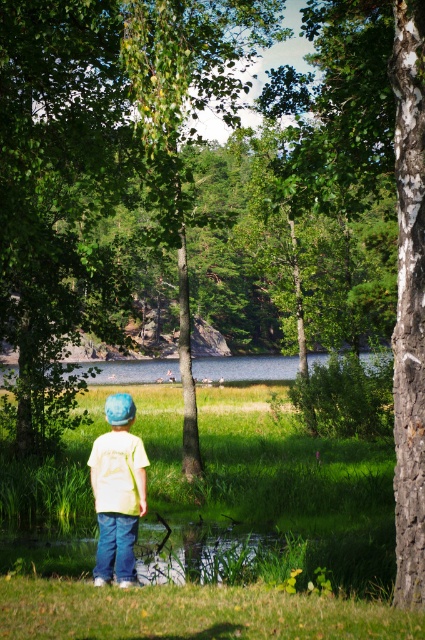
Question: Which object appears farthest from the camera in this image?

Choices:
 (A) clear blue water at center
 (B) green grass at lower center

Answer: (A)

Question: Does green grass at lower center appear on the left side of light yellow t-shirt at center?

Choices:
 (A) yes
 (B) no

Answer: (B)

Question: Which of the following is the farthest from the observer?

Choices:
 (A) clear blue water at center
 (B) light yellow t-shirt at center
 (C) green grass at lower center

Answer: (A)

Question: Which point is closer to the camera taking this photo?

Choices:
 (A) (320, 621)
 (B) (360, 355)

Answer: (A)

Question: Is green grass at lower center smaller than clear blue water at center?

Choices:
 (A) yes
 (B) no

Answer: (A)

Question: Can you confirm if green grass at lower center is positioned above clear blue water at center?

Choices:
 (A) no
 (B) yes

Answer: (A)